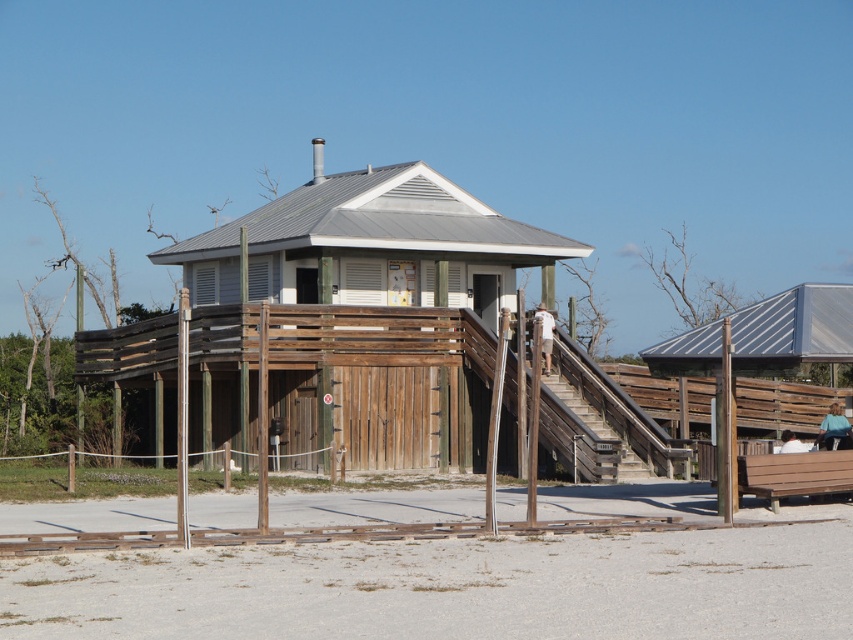
Who is higher up, white cotton shorts at center or light blue shirt at lower right?

white cotton shorts at center is above.

Who is positioned more to the left, white cotton shorts at center or light blue shirt at lower right?

From the viewer's perspective, white cotton shorts at center appears more on the left side.

You are a GUI agent. You are given a task and a screenshot of the screen. Output one action in this format:
    pyautogui.click(x=<x>, y=<y>)
    Task: Click on the white cotton shorts at center
    The height and width of the screenshot is (640, 853).
    Given the screenshot: What is the action you would take?
    pyautogui.click(x=544, y=332)

Locate an element on the screen. This screenshot has height=640, width=853. white cotton shorts at center is located at coordinates (544, 332).

What are the coordinates of `metallic gray bench at right` in the screenshot? It's located at (764, 336).

Is metallic gray bench at right positioned at the back of white cotton shorts at center?

Yes, it is.

Find the location of `metallic gray bench at right`. metallic gray bench at right is located at coordinates (764, 336).

Where is `metallic gray bench at right`? This screenshot has height=640, width=853. metallic gray bench at right is located at coordinates (764, 336).

Is white sandy beach at lower center thinner than metallic gray bench at right?

In fact, white sandy beach at lower center might be wider than metallic gray bench at right.

This screenshot has width=853, height=640. What do you see at coordinates (451, 588) in the screenshot?
I see `white sandy beach at lower center` at bounding box center [451, 588].

At what (x,y) coordinates should I click in order to perform the action: click on white sandy beach at lower center. Please return your answer as a coordinate pair (x, y). The width and height of the screenshot is (853, 640). Looking at the image, I should click on (451, 588).